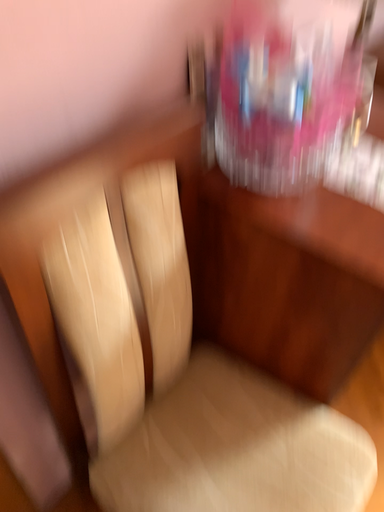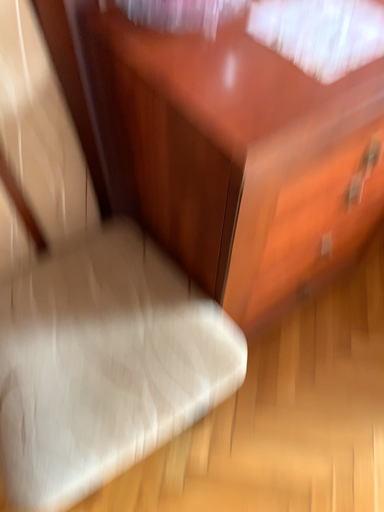
Question: How did the camera likely rotate when shooting the video?

Choices:
 (A) rotated right
 (B) rotated left

Answer: (B)